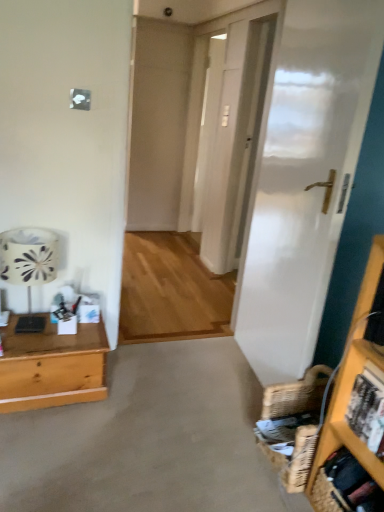
At what (x,y) coordinates should I click in order to perform the action: click on unoccupied region to the right of wooden desk at left. Please return your answer as a coordinate pair (x, y). Image resolution: width=384 pixels, height=512 pixels. Looking at the image, I should click on (141, 394).